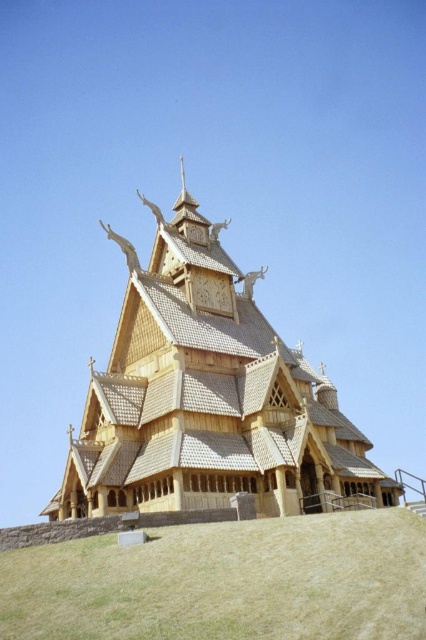
You are standing in front of the traditional wooden structure and want to take a photo. There are two points marked on the building, point 1 at coordinates point (175, 208) and point 2 at coordinates point (247, 598). Which point is closer to the camera?

Point (175, 208) is further to the camera than point (247, 598), so point (247, 598) is closer to the camera.